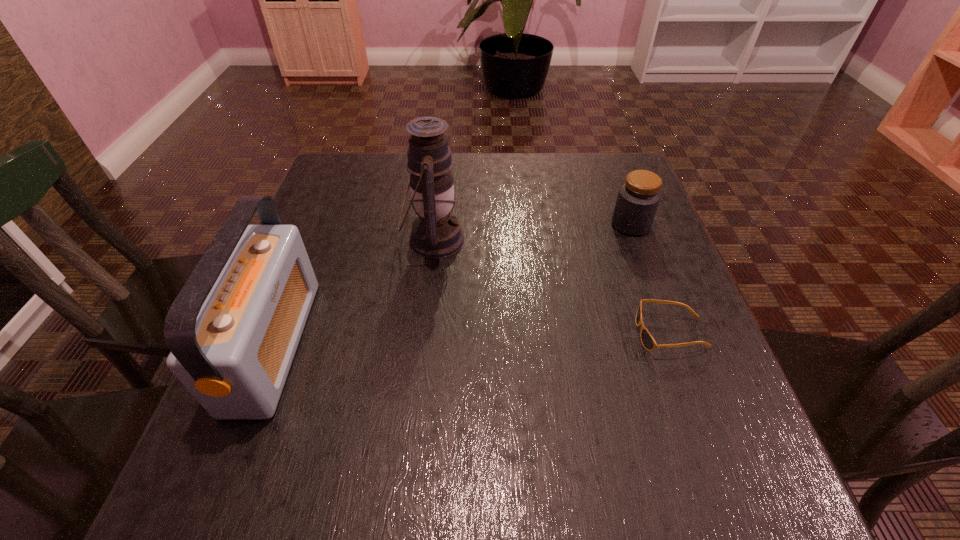
In the image, there is a desktop. What are the coordinates of `vacant space at the far right corner` in the screenshot? It's located at (579, 168).

Where is `free location at the near right corner`? free location at the near right corner is located at coordinates (752, 507).

You are a GUI agent. You are given a task and a screenshot of the screen. Output one action in this format:
    pyautogui.click(x=<x>, y=<y>)
    Task: Click on the vacant area that lies between the sunglasses and the jar
    The image size is (960, 540).
    Given the screenshot: What is the action you would take?
    pyautogui.click(x=651, y=279)

The width and height of the screenshot is (960, 540). I want to click on free space between the third shortest object and the jar, so click(x=452, y=285).

The height and width of the screenshot is (540, 960). Find the location of `free space between the third shortest object and the jar`. free space between the third shortest object and the jar is located at coordinates (452, 285).

Find the location of `unoccupied position between the radio receiver and the sunglasses`. unoccupied position between the radio receiver and the sunglasses is located at coordinates (472, 339).

At what (x,y) coordinates should I click in order to perform the action: click on unoccupied area between the leftmost object and the oil lamp. Please return your answer as a coordinate pair (x, y). The height and width of the screenshot is (540, 960). Looking at the image, I should click on (353, 292).

You are a GUI agent. You are given a task and a screenshot of the screen. Output one action in this format:
    pyautogui.click(x=<x>, y=<y>)
    Task: Click on the blank region between the oil lamp and the sunglasses
    
    Given the screenshot: What is the action you would take?
    pyautogui.click(x=552, y=287)

At what (x,y) coordinates should I click in order to perform the action: click on free space between the second shortest object and the second object from left to right. Please return your answer as a coordinate pair (x, y). Image resolution: width=960 pixels, height=540 pixels. Looking at the image, I should click on (532, 232).

The image size is (960, 540). Identify the location of free space between the oil lamp and the second shortest object. (532, 232).